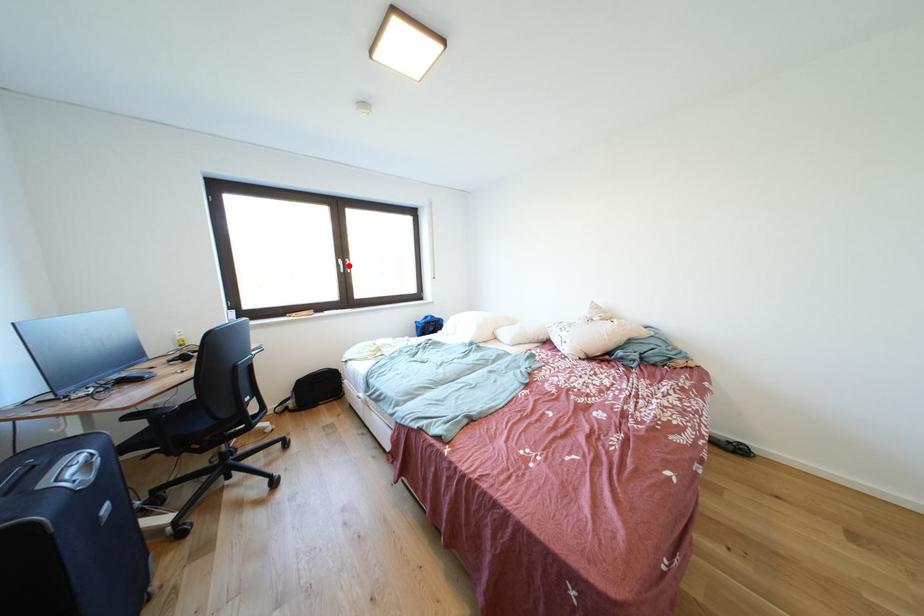
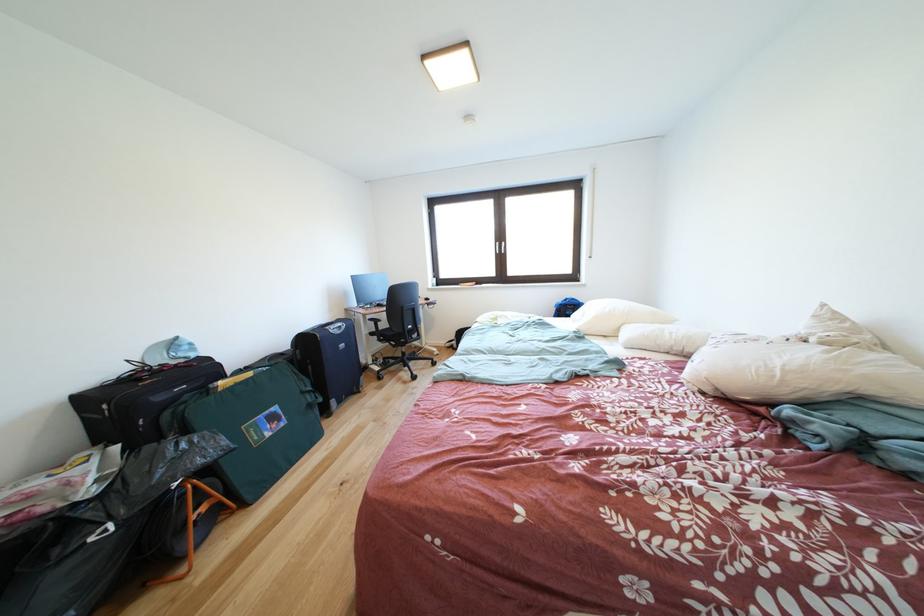
In the second image, find the point that corresponds to the highlighted location in the first image.

(505, 249)